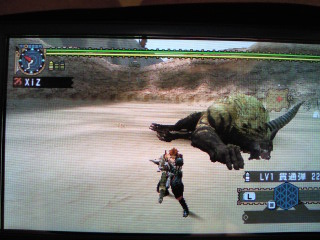
The image size is (320, 240). What are the coordinates of `television` in the screenshot? It's located at (60, 38).